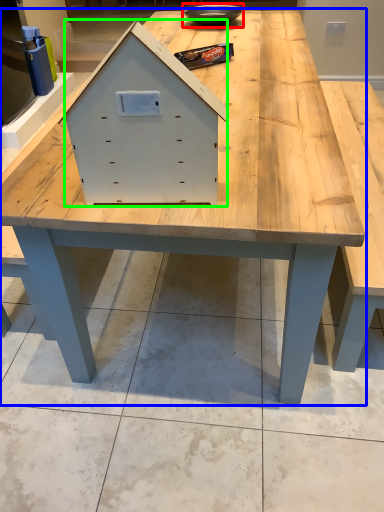
Question: Which is farther away from bowl (highlighted by a red box)? table (highlighted by a blue box) or drawer (highlighted by a green box)?

Choices:
 (A) table
 (B) drawer

Answer: (B)